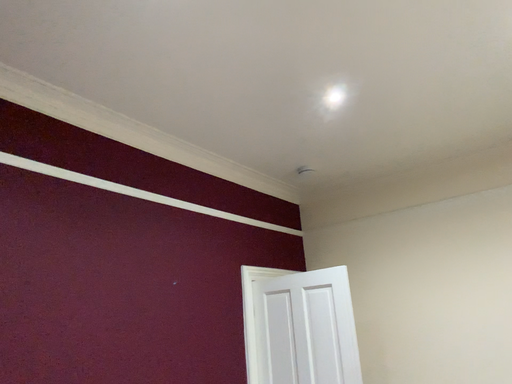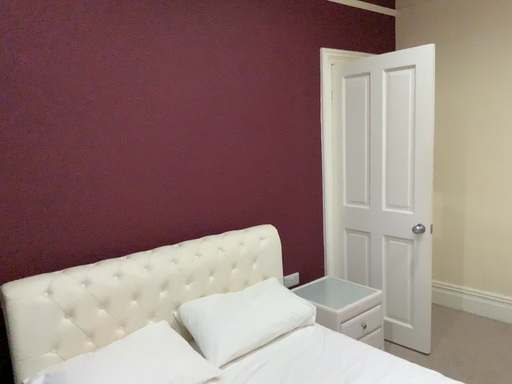
Question: How did the camera likely rotate when shooting the video?

Choices:
 (A) rotated left
 (B) rotated right

Answer: (A)